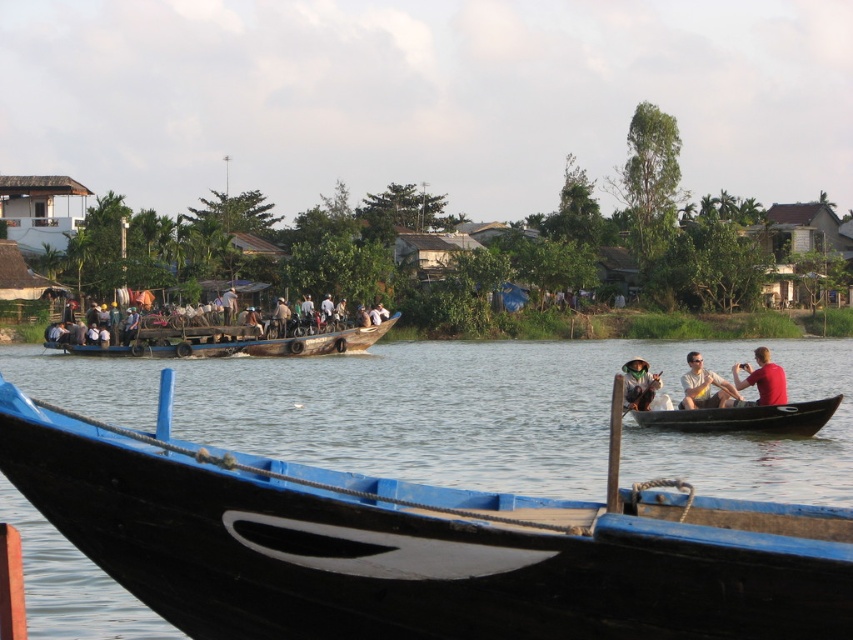
Question: Does wooden boat at center have a larger size compared to red matte shirt at right?

Choices:
 (A) yes
 (B) no

Answer: (A)

Question: Which point is closer to the camera taking this photo?

Choices:
 (A) [675, 420]
 (B) [662, 474]
 (C) [706, 380]
 (D) [648, 376]

Answer: (B)

Question: Does black wood boat at center have a greater width compared to matte green hat at lower right?

Choices:
 (A) yes
 (B) no

Answer: (A)

Question: Which point is farther to the camera?

Choices:
 (A) black wood boat at center
 (B) wooden boat at center
 (C) black wood canoe at right

Answer: (B)

Question: Does wooden boat at center appear on the right side of matte green hat at lower right?

Choices:
 (A) no
 (B) yes

Answer: (A)

Question: Which object is closer to the camera taking this photo?

Choices:
 (A) matte white shirt at center
 (B) black wood canoe at right

Answer: (B)